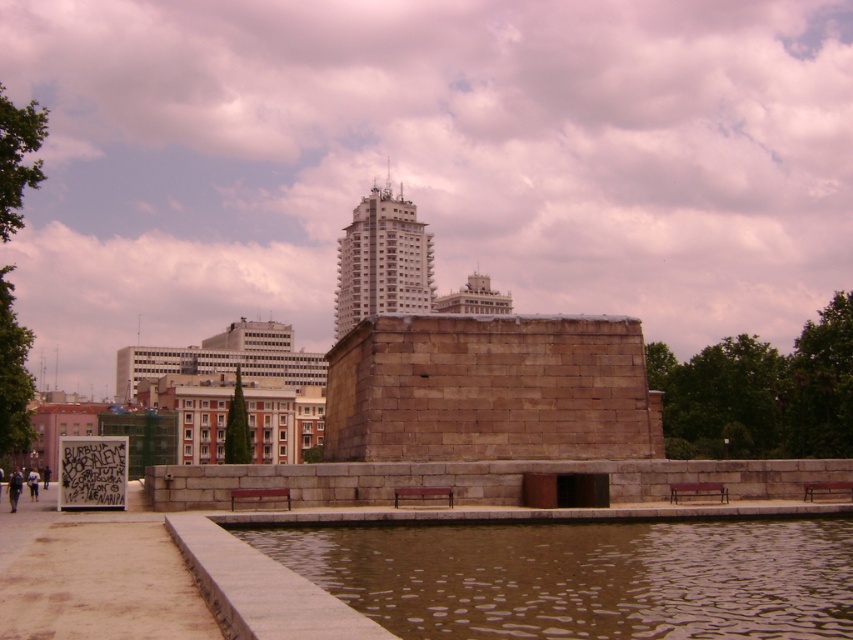
Question: Does brown water at lower center have a lesser width compared to white stone building at center?

Choices:
 (A) yes
 (B) no

Answer: (A)

Question: Which of the following is the farthest from the observer?

Choices:
 (A) (341, 326)
 (B) (213, 337)
 (C) (383, 540)

Answer: (B)

Question: Does white concrete building at upper center have a larger size compared to white stone building at center?

Choices:
 (A) no
 (B) yes

Answer: (A)

Question: Which point is farther from the camera taking this photo?

Choices:
 (A) (424, 288)
 (B) (262, 344)

Answer: (A)

Question: Which point appears farthest from the camera in this image?

Choices:
 (A) (415, 564)
 (B) (428, 304)

Answer: (B)

Question: Can you confirm if white concrete building at upper center is positioned below white stone building at center?

Choices:
 (A) no
 (B) yes

Answer: (A)